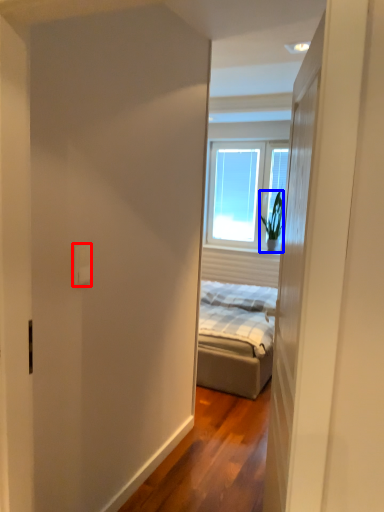
Question: Among these objects, which one is nearest to the camera, electric outlet (highlighted by a red box) or houseplant (highlighted by a blue box)?

Choices:
 (A) electric outlet
 (B) houseplant

Answer: (A)